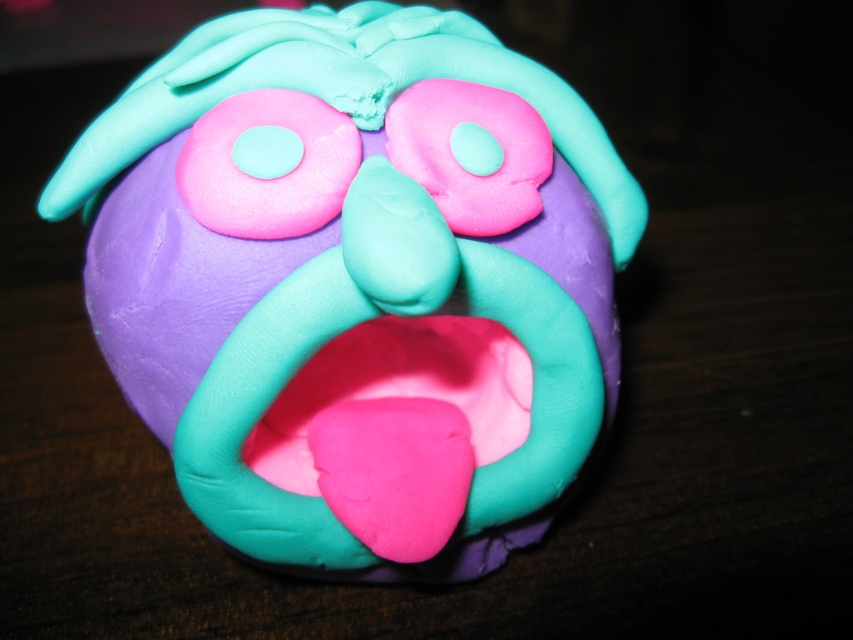
You are an artist trying to place a pink matte donut at upper center on top of the matte clay face at center. Based on their widths, will the donut fit horizontally without overlapping the edges of the face?

The matte clay face at center might be wider than the pink matte donut at upper center, so there is a possibility that the donut will fit without overlapping the edges. However, the exact positioning would depend on the specific dimensions and alignment.

You are an art student who wants to place a small sticker on the object that is taller between the matte clay face at center and the pink matte donut at upper center. Which object should you choose?

The matte clay face at center is taller than the pink matte donut at upper center, so you should place the sticker on the matte clay face at center.

What are the coordinates of the matte clay face at center?

The matte clay face at center is located at point (357, 280).